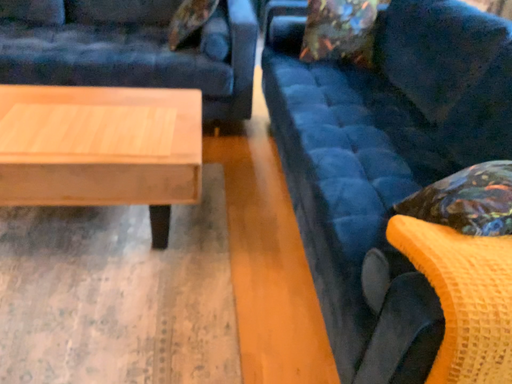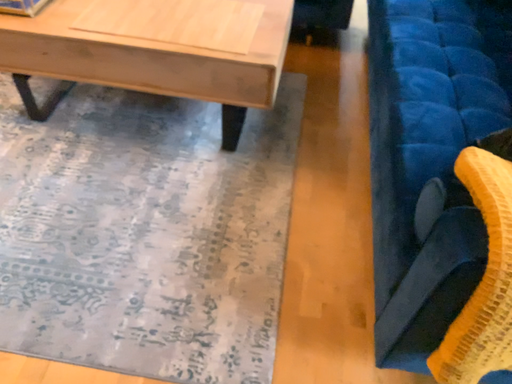
Question: Which way did the camera rotate in the video?

Choices:
 (A) rotated downward
 (B) rotated upward

Answer: (A)